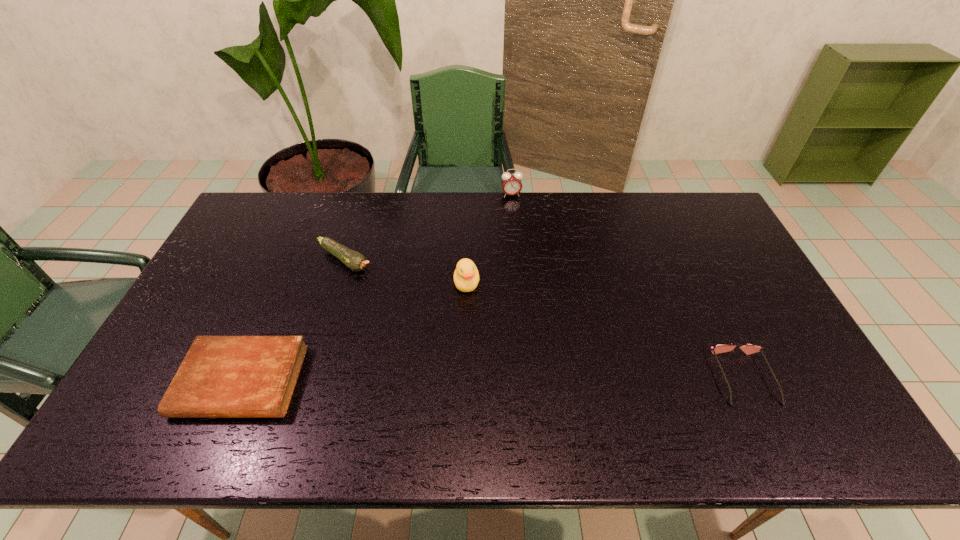
I want to click on Bible, so click(x=221, y=376).

Locate an element on the screen. The width and height of the screenshot is (960, 540). the rightmost object is located at coordinates (749, 348).

At what (x,y) coordinates should I click in order to perform the action: click on the farthest object. Please return your answer as a coordinate pair (x, y). This screenshot has width=960, height=540. Looking at the image, I should click on (511, 182).

Locate an element on the screen. alarm clock is located at coordinates (511, 182).

This screenshot has height=540, width=960. I want to click on the third object from right to left, so [466, 276].

The height and width of the screenshot is (540, 960). Identify the location of the third tallest object. (354, 260).

At what (x,y) coordinates should I click in order to perform the action: click on free location located on the clock face of the farthest object. Please return your answer as a coordinate pair (x, y). The image size is (960, 540). Looking at the image, I should click on (517, 217).

You are a GUI agent. You are given a task and a screenshot of the screen. Output one action in this format:
    pyautogui.click(x=<x>, y=<y>)
    Task: Click on the vacant space located on the clock face of the farthest object
    
    Given the screenshot: What is the action you would take?
    (x=520, y=231)

The width and height of the screenshot is (960, 540). I want to click on vacant space located on the clock face of the farthest object, so click(x=520, y=231).

This screenshot has height=540, width=960. Find the location of `vacant position located on the face of the third object from left to right`. vacant position located on the face of the third object from left to right is located at coordinates (467, 398).